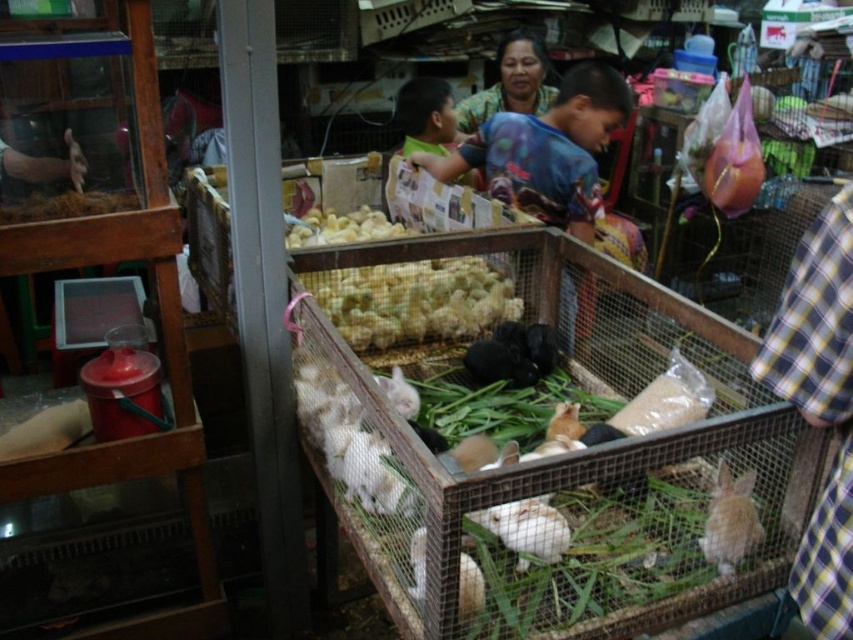
Question: Among these objects, which one is farthest from the camera?

Choices:
 (A) plaid fabric shirt at right
 (B) yellow soft hay at center
 (C) brown grain at upper left
 (D) white fur rabbit at center

Answer: (B)

Question: Among these objects, which one is farthest from the camera?

Choices:
 (A) yellow fluffy chicks at upper center
 (B) yellow soft hay at center

Answer: (A)

Question: From the image, what is the correct spatial relationship of white fluffy rabbit at center in relation to brown grain at upper left?

Choices:
 (A) above
 (B) below

Answer: (B)

Question: Among these objects, which one is nearest to the camera?

Choices:
 (A) plaid fabric shirt at right
 (B) yellow fluffy chicks at upper center
 (C) white fluffy rabbit at center
 (D) green plaid shirt at upper center

Answer: (A)

Question: Does green plaid shirt at upper center have a smaller size compared to yellow fluffy chicks at upper center?

Choices:
 (A) no
 (B) yes

Answer: (A)

Question: Can you confirm if plaid fabric shirt at right is smaller than white fluffy rabbit at center?

Choices:
 (A) no
 (B) yes

Answer: (A)